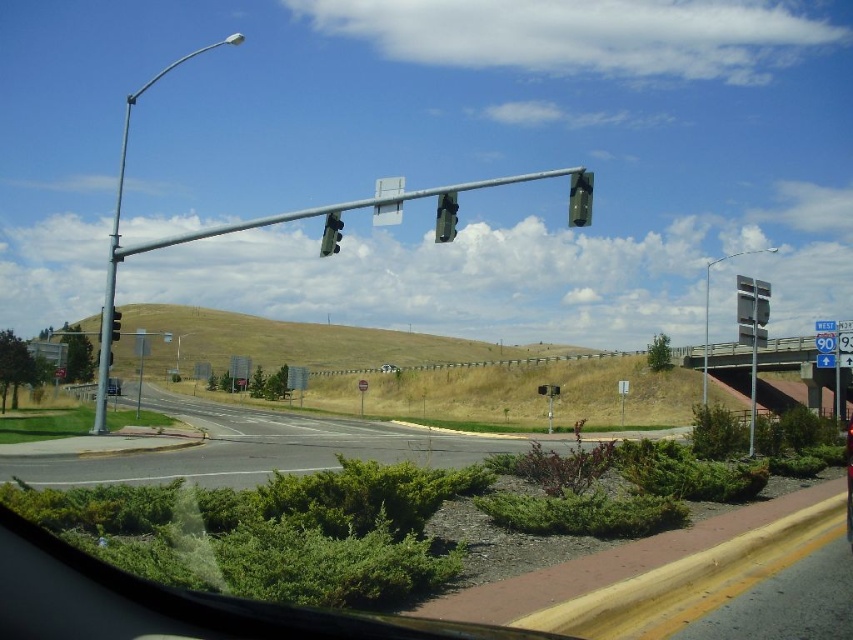
Question: Estimate the real-world distances between objects in this image. Which object is farther from the metallic gray traffic light at upper center?

Choices:
 (A) metallic pole at upper center
 (B) metallic traffic light at upper center
 (C) metallic gray sign at upper right

Answer: (A)

Question: Does gravel asphalt highway at lower left lie in front of matte black traffic light at center?

Choices:
 (A) no
 (B) yes

Answer: (B)

Question: Does gravel asphalt highway at lower left have a greater width compared to metallic gray sign at upper right?

Choices:
 (A) no
 (B) yes

Answer: (A)

Question: Which of the following is the farthest from the observer?

Choices:
 (A) (109, 321)
 (B) (178, 348)
 (C) (741, 296)
 (D) (444, 196)

Answer: (B)

Question: Which point appears closest to the camera in this image?

Choices:
 (A) (225, 464)
 (B) (117, 314)

Answer: (A)

Question: Can you confirm if metallic pole at left is smaller than metallic pole at upper center?

Choices:
 (A) yes
 (B) no

Answer: (B)